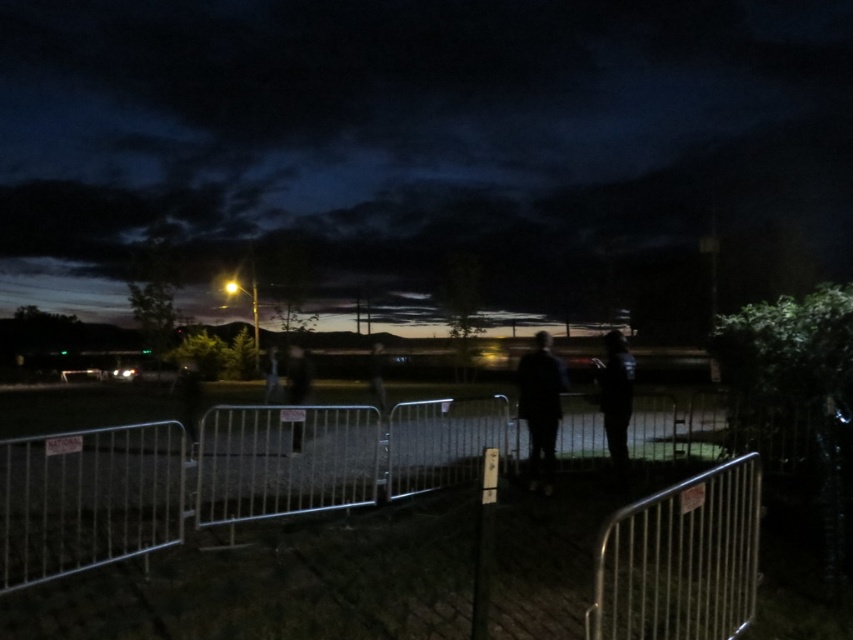
Question: Which object appears closest to the camera in this image?

Choices:
 (A) dark blue fabric jacket at center
 (B) metallic silver barricade at center

Answer: (B)

Question: Can you confirm if dark fabric jacket at center is positioned above dark blue fabric jacket at center?

Choices:
 (A) no
 (B) yes

Answer: (B)

Question: Which point is closer to the camera?

Choices:
 (A) metallic silver barricade at center
 (B) dark fabric jacket at center
 (C) dark blue fabric jacket at center

Answer: (A)

Question: Which object is the closest to the metallic silver barricade at center?

Choices:
 (A) dark blue fabric jacket at center
 (B) dark fabric jacket at center

Answer: (B)

Question: Does metallic silver barricade at center appear over dark fabric jacket at center?

Choices:
 (A) no
 (B) yes

Answer: (A)

Question: Is metallic silver barricade at center bigger than dark blue fabric jacket at center?

Choices:
 (A) no
 (B) yes

Answer: (B)